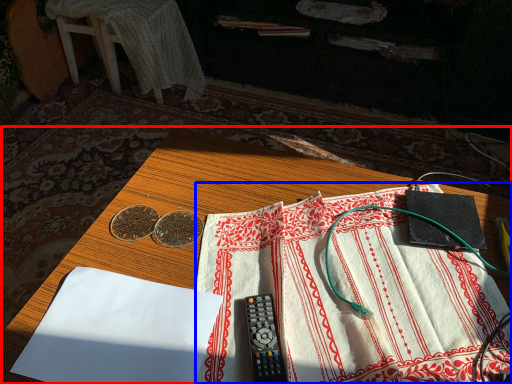
Question: Which object appears closest to the camera in this image, table (highlighted by a red box) or sheet (highlighted by a blue box)?

Choices:
 (A) table
 (B) sheet

Answer: (A)